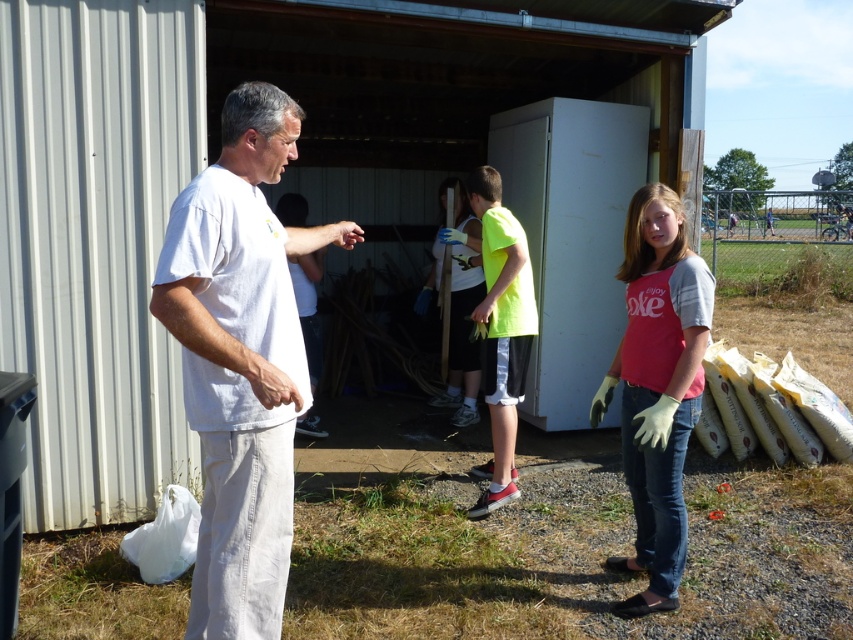
Question: Which of these objects is positioned closest to the matte pink t-shirt at center?

Choices:
 (A) white cotton shirt at left
 (B) neon green jersey at center

Answer: (A)

Question: Does white cotton shirt at left appear under matte pink t-shirt at center?

Choices:
 (A) yes
 (B) no

Answer: (B)

Question: Which point is farther to the camera?

Choices:
 (A) neon green jersey at center
 (B) matte pink t-shirt at center

Answer: (A)

Question: Is the position of white cotton shirt at left more distant than that of matte pink t-shirt at center?

Choices:
 (A) yes
 (B) no

Answer: (B)

Question: Which point is closer to the camera?

Choices:
 (A) (685, 328)
 (B) (241, 204)
 (C) (479, 348)

Answer: (B)

Question: Can you confirm if white cotton shirt at left is positioned to the right of neon green jersey at center?

Choices:
 (A) no
 (B) yes

Answer: (A)